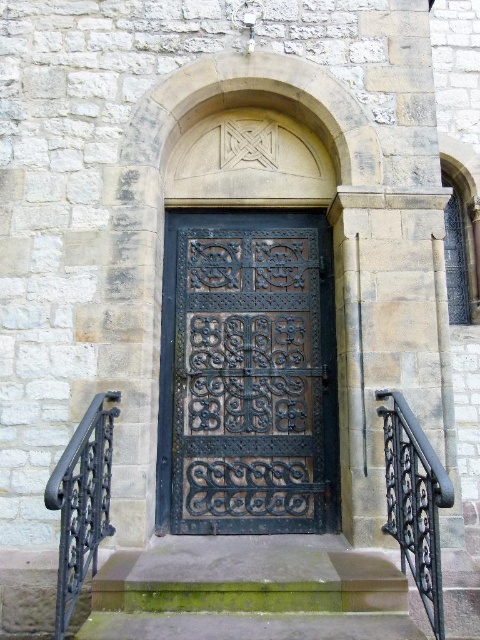
Consider the image. Does dark brown wrought iron door at center appear under black wrought iron railing at left?

Incorrect, dark brown wrought iron door at center is not positioned below black wrought iron railing at left.

Is dark brown wrought iron door at center wider than black wrought iron railing at left?

Yes, dark brown wrought iron door at center is wider than black wrought iron railing at left.

Which is behind, point (330, 376) or point (68, 624)?

Positioned behind is point (330, 376).

Where is `dark brown wrought iron door at center`? Image resolution: width=480 pixels, height=640 pixels. dark brown wrought iron door at center is located at coordinates (247, 374).

Does black wrought iron railing at right have a lesser width compared to black wrought iron railing at left?

Yes, black wrought iron railing at right is thinner than black wrought iron railing at left.

Measure the distance between black wrought iron railing at right and black wrought iron railing at left.

They are 5.40 feet apart.

Who is more distant from viewer, (420,499) or (78,442)?

Positioned behind is point (420,499).

Locate an element on the screen. The height and width of the screenshot is (640, 480). black wrought iron railing at right is located at coordinates (415, 500).

Is dark brown wrought iron door at center shorter than black wrought iron railing at right?

No.

Can you confirm if dark brown wrought iron door at center is positioned below black wrought iron railing at right?

→ Incorrect, dark brown wrought iron door at center is not positioned below black wrought iron railing at right.

Is point (287, 250) positioned in front of point (420, 490)?

No, it is behind (420, 490).

Locate an element on the screen. This screenshot has width=480, height=640. dark brown wrought iron door at center is located at coordinates [x=247, y=374].